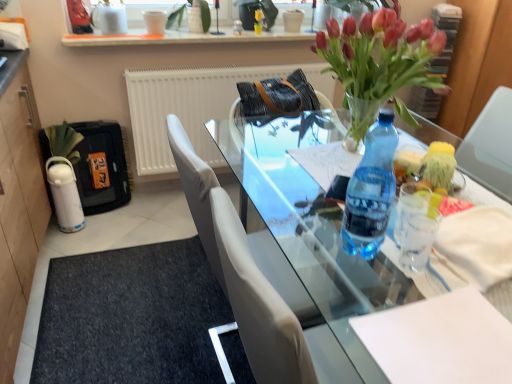
Question: Is white matte flowerpot at upper center at the left side of white paper at center?

Choices:
 (A) no
 (B) yes

Answer: (B)

Question: From the image's perspective, is white matte flowerpot at upper center below white paper at center?

Choices:
 (A) no
 (B) yes

Answer: (A)

Question: Are white matte flowerpot at upper center and white paper at center far apart?

Choices:
 (A) yes
 (B) no

Answer: (A)

Question: Considering the relative sizes of white matte flowerpot at upper center and white paper at center in the image provided, is white matte flowerpot at upper center thinner than white paper at center?

Choices:
 (A) yes
 (B) no

Answer: (A)

Question: Is white matte flowerpot at upper center with white paper at center?

Choices:
 (A) no
 (B) yes

Answer: (A)

Question: From a real-world perspective, is white matte flowerpot at upper center below white paper at center?

Choices:
 (A) no
 (B) yes

Answer: (A)

Question: From a real-world perspective, is white matte radiator at upper center under transparent glass table at center?

Choices:
 (A) no
 (B) yes

Answer: (A)

Question: Are white matte radiator at upper center and transparent glass table at center located far from each other?

Choices:
 (A) yes
 (B) no

Answer: (B)

Question: Does white matte radiator at upper center have a greater height compared to transparent glass table at center?

Choices:
 (A) yes
 (B) no

Answer: (B)

Question: Can you confirm if white matte radiator at upper center is shorter than transparent glass table at center?

Choices:
 (A) yes
 (B) no

Answer: (A)

Question: From the image's perspective, is white matte radiator at upper center above transparent glass table at center?

Choices:
 (A) yes
 (B) no

Answer: (A)

Question: Can you confirm if white matte radiator at upper center is positioned to the right of transparent glass table at center?

Choices:
 (A) no
 (B) yes

Answer: (A)

Question: Can you confirm if leather at center is smaller than white matte radiator at upper center?

Choices:
 (A) yes
 (B) no

Answer: (A)